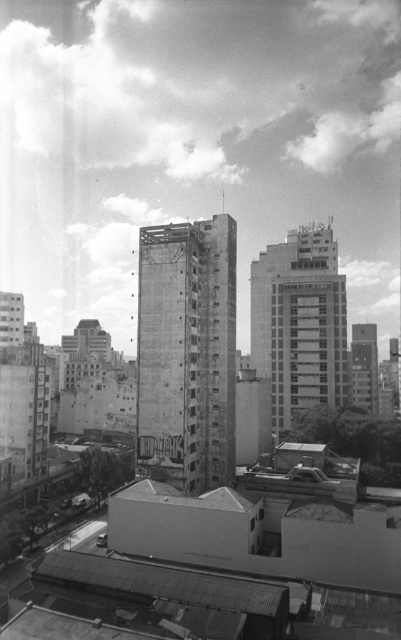
Question: Does concrete building at center appear under smooth glass building at center?

Choices:
 (A) no
 (B) yes

Answer: (B)

Question: Considering the relative positions of concrete building at center and smooth glass building at center in the image provided, where is concrete building at center located with respect to smooth glass building at center?

Choices:
 (A) right
 (B) left

Answer: (B)

Question: Does concrete building at center have a lesser width compared to smooth glass building at center?

Choices:
 (A) yes
 (B) no

Answer: (A)

Question: Which point is farther to the camera?

Choices:
 (A) (336, 253)
 (B) (155, 272)

Answer: (A)